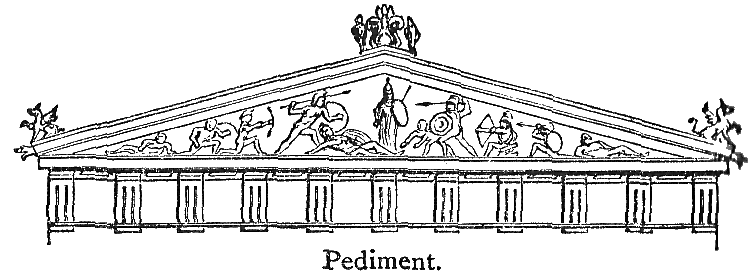
You are a GUI agent. You are given a task and a screenshot of the screen. Output one action in this format:
    pyautogui.click(x=<x>, y=<y>)
    Task: Click on the pillar
    
    Given the screenshot: What is the action you would take?
    pyautogui.click(x=643, y=202)